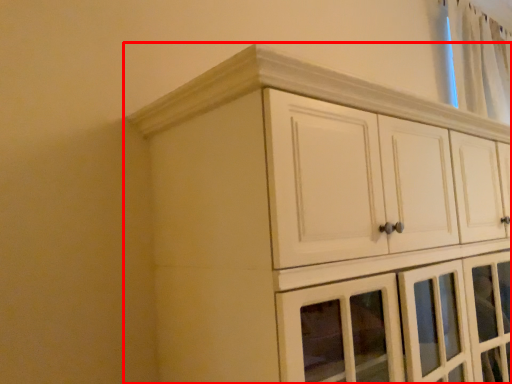
Question: Where is cupboard (annotated by the red box) located in relation to curtain in the image?

Choices:
 (A) left
 (B) right

Answer: (A)